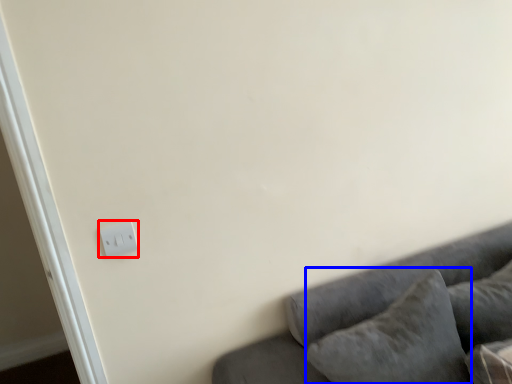
Question: Which of the following is the closest to the observer, light switch (highlighted by a red box) or pillow (highlighted by a blue box)?

Choices:
 (A) light switch
 (B) pillow

Answer: (B)